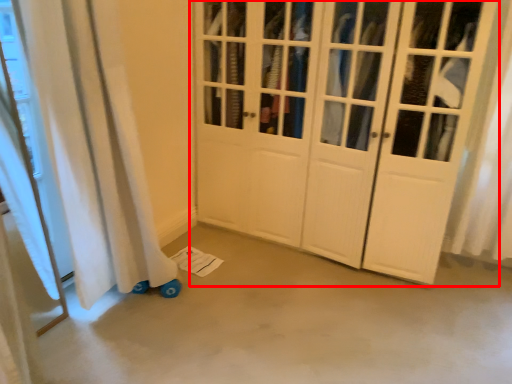
Question: From the image's perspective, considering the relative positions of door (annotated by the red box) and concrete in the image provided, where is door (annotated by the red box) located with respect to the staircase?

Choices:
 (A) below
 (B) above

Answer: (B)